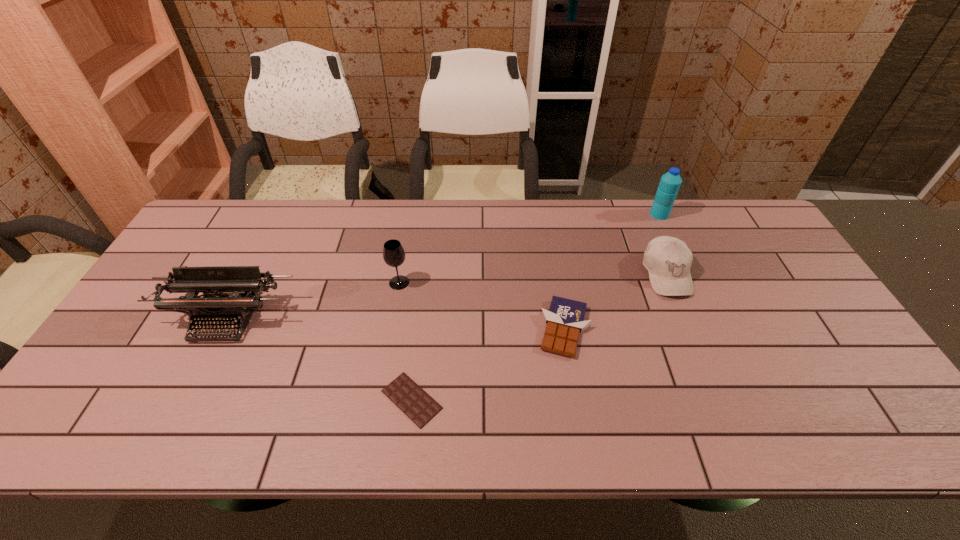
You are a GUI agent. You are given a task and a screenshot of the screen. Output one action in this format:
    pyautogui.click(x=<x>, y=<y>)
    Task: Click on the vacant space at the left edge of the desktop
    The width and height of the screenshot is (960, 540).
    Given the screenshot: What is the action you would take?
    pyautogui.click(x=141, y=370)

Locate an element on the screen. vacant space at the right edge of the desktop is located at coordinates (838, 346).

This screenshot has height=540, width=960. In the image, there is a desktop. In order to click on vacant space at the far right corner in this screenshot , I will do `click(729, 224)`.

Where is `empty space that is in between the nearer chocolate bar and the baseball cap`? empty space that is in between the nearer chocolate bar and the baseball cap is located at coordinates (540, 337).

This screenshot has width=960, height=540. I want to click on vacant point located between the leftmost object and the fifth tallest object, so click(395, 324).

The height and width of the screenshot is (540, 960). I want to click on unoccupied position between the baseball cap and the shorter chocolate bar, so click(x=540, y=337).

Locate an element on the screen. Image resolution: width=960 pixels, height=540 pixels. vacant space in between the farthest object and the left chocolate bar is located at coordinates (536, 307).

At what (x,y) coordinates should I click in order to perform the action: click on free space between the farther chocolate bar and the wineglass. Please return your answer as a coordinate pair (x, y). This screenshot has width=960, height=540. Looking at the image, I should click on (482, 306).

You are a GUI agent. You are given a task and a screenshot of the screen. Output one action in this format:
    pyautogui.click(x=<x>, y=<y>)
    Task: Click on the free spot between the tallest object and the shorter chocolate bar
    Image resolution: width=960 pixels, height=540 pixels.
    Given the screenshot: What is the action you would take?
    pyautogui.click(x=536, y=307)

The width and height of the screenshot is (960, 540). In order to click on free space between the tallest object and the leftmost object in this screenshot , I will do `click(443, 267)`.